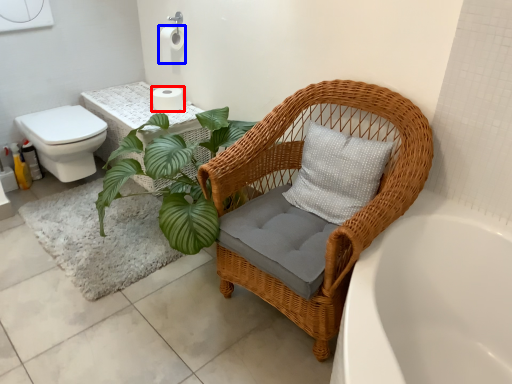
Question: Which point is further to the camera, toilet paper (highlighted by a red box) or toilet paper (highlighted by a blue box)?

Choices:
 (A) toilet paper
 (B) toilet paper

Answer: (A)